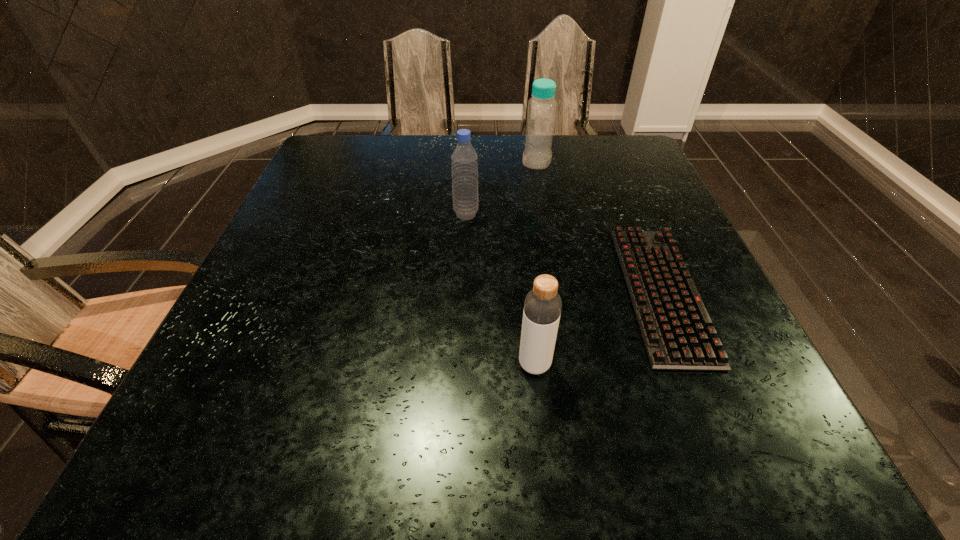
Locate an element on the screen. The image size is (960, 540). vacant area that lies between the farthest bottle and the shortest object is located at coordinates (599, 227).

This screenshot has width=960, height=540. Identify the location of free space between the third nearest object and the rightmost object. (564, 253).

I want to click on free space between the rightmost object and the farthest bottle, so click(599, 227).

You are a GUI agent. You are given a task and a screenshot of the screen. Output one action in this format:
    pyautogui.click(x=<x>, y=<y>)
    Task: Click on the free space between the farthest bottle and the nearest bottle
    The image size is (960, 540).
    Given the screenshot: What is the action you would take?
    pyautogui.click(x=536, y=263)

This screenshot has width=960, height=540. What are the coordinates of `vacant space in between the farthest object and the computer keyboard` in the screenshot? It's located at point(599,227).

I want to click on unoccupied position between the leftmost bottle and the computer keyboard, so click(564, 253).

The image size is (960, 540). Identify the location of vacant space in between the second farthest bottle and the rightmost object. (564, 253).

Locate an element on the screen. The width and height of the screenshot is (960, 540). free space between the second nearest bottle and the nearest bottle is located at coordinates pos(500,289).

At what (x,y) coordinates should I click in order to perform the action: click on vacant space in between the leftmost object and the nearest bottle. Please return your answer as a coordinate pair (x, y). The image size is (960, 540). Looking at the image, I should click on (500, 289).

The width and height of the screenshot is (960, 540). Identify the location of object that stands as the third closest to the nearest bottle. (541, 111).